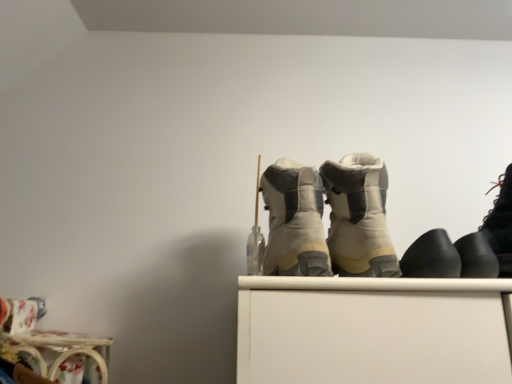
How much space does beige suede boots at center, positioned as the second footwear in left-to-right order, occupy vertically?

It is 8.90 inches.

What do you see at coordinates (477, 256) in the screenshot?
I see `black rubber shoes at right, which is the fourth footwear from left to right` at bounding box center [477, 256].

Describe the element at coordinates (501, 223) in the screenshot. I see `black leather boot at right, the fifth footwear positioned from the left` at that location.

What is the approximate width of beige suede boots at center, placed as the fifth footwear when sorted from right to left?

It is 9.18 inches.

Where is `beige suede boots at center, which is counted as the 1th footwear, starting from the left`? The height and width of the screenshot is (384, 512). beige suede boots at center, which is counted as the 1th footwear, starting from the left is located at coordinates (294, 221).

Where is `black matte boot at right, marked as the third footwear in a right-to-left arrangement`? black matte boot at right, marked as the third footwear in a right-to-left arrangement is located at coordinates (431, 257).

How different are the orientations of beige suede boots at center, positioned as the second footwear in left-to-right order, and black rubber shoes at right, which is the fourth footwear from left to right, in degrees?

There is a 0.00187-degree angle between the facing directions of beige suede boots at center, positioned as the second footwear in left-to-right order, and black rubber shoes at right, which is the fourth footwear from left to right.

Considering the points (361, 180) and (486, 270), which point is behind, point (361, 180) or point (486, 270)?

Point (361, 180)

Who is bigger, beige suede boots at center, which appears as the fourth footwear when viewed from the right, or black rubber shoes at right, the 2th footwear positioned from the right?

beige suede boots at center, which appears as the fourth footwear when viewed from the right, is bigger.

Between black matte boot at right, marked as the third footwear in a right-to-left arrangement, and black leather boot at right, the fifth footwear positioned from the left, which one is positioned in front?

black leather boot at right, the fifth footwear positioned from the left.

Could you tell me if black matte boot at right, marked as the third footwear in a right-to-left arrangement, is facing black leather boot at right, positioned as the first footwear in right-to-left order?

No, black matte boot at right, marked as the third footwear in a right-to-left arrangement, is not oriented towards black leather boot at right, positioned as the first footwear in right-to-left order.

From a real-world perspective, is black matte boot at right, marked as the third footwear in a right-to-left arrangement, under black leather boot at right, positioned as the first footwear in right-to-left order?

Correct, in the physical world, black matte boot at right, marked as the third footwear in a right-to-left arrangement, is lower than black leather boot at right, positioned as the first footwear in right-to-left order.

From the image's perspective, relative to black leather boot at right, positioned as the first footwear in right-to-left order, is black matte boot at right, which is the 3th footwear from left to right, above or below?

Based on their image positions, black matte boot at right, which is the 3th footwear from left to right, is located beneath black leather boot at right, positioned as the first footwear in right-to-left order.

Considering the relative sizes of beige suede boots at center, placed as the fifth footwear when sorted from right to left, and black leather boot at right, the fifth footwear positioned from the left, in the image provided, is beige suede boots at center, placed as the fifth footwear when sorted from right to left, bigger than black leather boot at right, the fifth footwear positioned from the left,?

Yes.

From a real-world perspective, who is located higher, beige suede boots at center, which is counted as the 1th footwear, starting from the left, or black leather boot at right, the fifth footwear positioned from the left?

In real-world perspective, beige suede boots at center, which is counted as the 1th footwear, starting from the left, is above.

Measure the distance between beige suede boots at center, placed as the fifth footwear when sorted from right to left, and black leather boot at right, positioned as the first footwear in right-to-left order.

The distance of beige suede boots at center, placed as the fifth footwear when sorted from right to left, from black leather boot at right, positioned as the first footwear in right-to-left order, is 12.03 inches.

Is black leather boot at right, the fifth footwear positioned from the left, oriented away from beige suede boots at center, positioned as the second footwear in left-to-right order?

No.

Can you confirm if black leather boot at right, the fifth footwear positioned from the left, is smaller than beige suede boots at center, positioned as the second footwear in left-to-right order?

Correct, black leather boot at right, the fifth footwear positioned from the left, occupies less space than beige suede boots at center, positioned as the second footwear in left-to-right order.

Can you tell me how much black leather boot at right, the fifth footwear positioned from the left, and beige suede boots at center, positioned as the second footwear in left-to-right order, differ in facing direction?

There is a 0.00031-degree angle between the facing directions of black leather boot at right, the fifth footwear positioned from the left, and beige suede boots at center, positioned as the second footwear in left-to-right order.

Between point (511, 270) and point (337, 271), which one is positioned behind?

The point (337, 271) is farther.

Is black leather boot at right, positioned as the first footwear in right-to-left order, oriented towards black rubber shoes at right, which is the fourth footwear from left to right?

No, black leather boot at right, positioned as the first footwear in right-to-left order, is not oriented towards black rubber shoes at right, which is the fourth footwear from left to right.

From the picture: From the image's perspective, is black leather boot at right, positioned as the first footwear in right-to-left order, located above or below black rubber shoes at right, which is the fourth footwear from left to right?

black leather boot at right, positioned as the first footwear in right-to-left order, is above black rubber shoes at right, which is the fourth footwear from left to right.

Does black leather boot at right, the fifth footwear positioned from the left, touch black rubber shoes at right, the 2th footwear positioned from the right?

Indeed, black leather boot at right, the fifth footwear positioned from the left, and black rubber shoes at right, the 2th footwear positioned from the right, are beside each other and touching.

Does black leather boot at right, positioned as the first footwear in right-to-left order, have a lesser width compared to black rubber shoes at right, which is the fourth footwear from left to right?

No, black leather boot at right, positioned as the first footwear in right-to-left order, is not thinner than black rubber shoes at right, which is the fourth footwear from left to right.

Is black leather boot at right, the fifth footwear positioned from the left, in contact with beige suede boots at center, which is counted as the 1th footwear, starting from the left?

No, black leather boot at right, the fifth footwear positioned from the left, is not touching beige suede boots at center, which is counted as the 1th footwear, starting from the left.

From a real-world perspective, which object stands above the other?

beige suede boots at center, placed as the fifth footwear when sorted from right to left, from a real-world perspective.

Looking at this image, is black leather boot at right, positioned as the first footwear in right-to-left order, not within beige suede boots at center, which is counted as the 1th footwear, starting from the left?

Indeed, black leather boot at right, positioned as the first footwear in right-to-left order, is completely outside beige suede boots at center, which is counted as the 1th footwear, starting from the left.

Which object is positioned more to the left, black leather boot at right, positioned as the first footwear in right-to-left order, or beige suede boots at center, placed as the fifth footwear when sorted from right to left?

From the viewer's perspective, beige suede boots at center, placed as the fifth footwear when sorted from right to left, appears more on the left side.

Is black rubber shoes at right, the 2th footwear positioned from the right, taller than beige suede boots at center, which appears as the fourth footwear when viewed from the right?

In fact, black rubber shoes at right, the 2th footwear positioned from the right, may be shorter than beige suede boots at center, which appears as the fourth footwear when viewed from the right.

Which object is positioned more to the right, black rubber shoes at right, the 2th footwear positioned from the right, or beige suede boots at center, which appears as the fourth footwear when viewed from the right?

From the viewer's perspective, black rubber shoes at right, the 2th footwear positioned from the right, appears more on the right side.

From the image's perspective, does black rubber shoes at right, which is the fourth footwear from left to right, appear higher than beige suede boots at center, which appears as the fourth footwear when viewed from the right?

Incorrect, from the image's perspective, black rubber shoes at right, which is the fourth footwear from left to right, is lower than beige suede boots at center, which appears as the fourth footwear when viewed from the right.

Is black rubber shoes at right, which is the fourth footwear from left to right, facing towards beige suede boots at center, which appears as the fourth footwear when viewed from the right?

No.

This screenshot has height=384, width=512. What are the coordinates of `footwear that is the 3rd one when counting downward from the beige suede boots at center, positioned as the second footwear in left-to-right order (from the image's perspective)` in the screenshot? It's located at (477, 256).

The image size is (512, 384). I want to click on footwear that is the 2nd one when counting forward from the black matte boot at right, marked as the third footwear in a right-to-left arrangement, so coord(501,223).

Based on their spatial positions, is black leather boot at right, the fifth footwear positioned from the left, or beige suede boots at center, placed as the fifth footwear when sorted from right to left, further from black matte boot at right, marked as the third footwear in a right-to-left arrangement?

beige suede boots at center, placed as the fifth footwear when sorted from right to left, is positioned further to the anchor black matte boot at right, marked as the third footwear in a right-to-left arrangement.

Based on their spatial positions, is black leather boot at right, positioned as the first footwear in right-to-left order, or black rubber shoes at right, the 2th footwear positioned from the right, further from beige suede boots at center, placed as the fifth footwear when sorted from right to left?

The object further to beige suede boots at center, placed as the fifth footwear when sorted from right to left, is black leather boot at right, positioned as the first footwear in right-to-left order.

From the image, which object appears to be farther from beige suede boots at center, which appears as the fourth footwear when viewed from the right, black matte boot at right, marked as the third footwear in a right-to-left arrangement, or black leather boot at right, the fifth footwear positioned from the left?

Among the two, black leather boot at right, the fifth footwear positioned from the left, is located further to beige suede boots at center, which appears as the fourth footwear when viewed from the right.

Based on the photo, when comparing their distances from black rubber shoes at right, which is the fourth footwear from left to right, does beige suede boots at center, positioned as the second footwear in left-to-right order, or black leather boot at right, positioned as the first footwear in right-to-left order, seem closer?

Among the two, black leather boot at right, positioned as the first footwear in right-to-left order, is located nearer to black rubber shoes at right, which is the fourth footwear from left to right.

Which object lies nearer to the anchor point black matte boot at right, marked as the third footwear in a right-to-left arrangement, beige suede boots at center, which is counted as the 1th footwear, starting from the left, or black rubber shoes at right, which is the fourth footwear from left to right?

black rubber shoes at right, which is the fourth footwear from left to right, lies closer to black matte boot at right, marked as the third footwear in a right-to-left arrangement, than the other object.

Estimate the real-world distances between objects in this image. Which object is further from beige suede boots at center, positioned as the second footwear in left-to-right order, beige suede boots at center, which is counted as the 1th footwear, starting from the left, or black rubber shoes at right, the 2th footwear positioned from the right?

Based on the image, black rubber shoes at right, the 2th footwear positioned from the right, appears to be further to beige suede boots at center, positioned as the second footwear in left-to-right order.

Looking at the image, which one is located further to beige suede boots at center, which appears as the fourth footwear when viewed from the right, black rubber shoes at right, which is the fourth footwear from left to right, or black matte boot at right, which is the 3th footwear from left to right?

black rubber shoes at right, which is the fourth footwear from left to right.

Which object lies further to the anchor point black leather boot at right, the fifth footwear positioned from the left, black rubber shoes at right, which is the fourth footwear from left to right, or black matte boot at right, marked as the third footwear in a right-to-left arrangement?

The object further to black leather boot at right, the fifth footwear positioned from the left, is black matte boot at right, marked as the third footwear in a right-to-left arrangement.

Identify the location of footwear located between beige suede boots at center, placed as the fifth footwear when sorted from right to left, and black matte boot at right, marked as the third footwear in a right-to-left arrangement, in the left-right direction. Image resolution: width=512 pixels, height=384 pixels. (358, 217).

Image resolution: width=512 pixels, height=384 pixels. In order to click on footwear between black matte boot at right, marked as the third footwear in a right-to-left arrangement, and black leather boot at right, the fifth footwear positioned from the left in this screenshot , I will do `click(477, 256)`.

Locate an element on the screen. This screenshot has width=512, height=384. footwear situated between beige suede boots at center, which appears as the fourth footwear when viewed from the right, and black rubber shoes at right, the 2th footwear positioned from the right, from left to right is located at coordinates (431, 257).